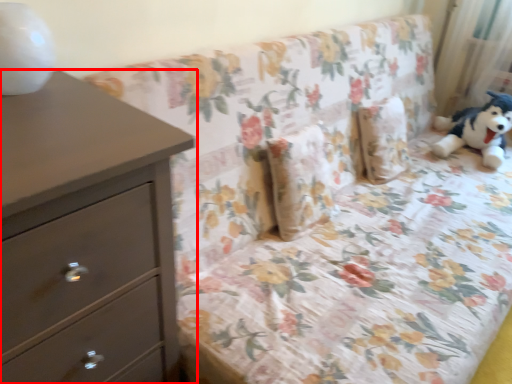
Question: From the image, what is the correct spatial relationship of chest of drawers (annotated by the red box) in relation to curtain?

Choices:
 (A) right
 (B) left

Answer: (B)